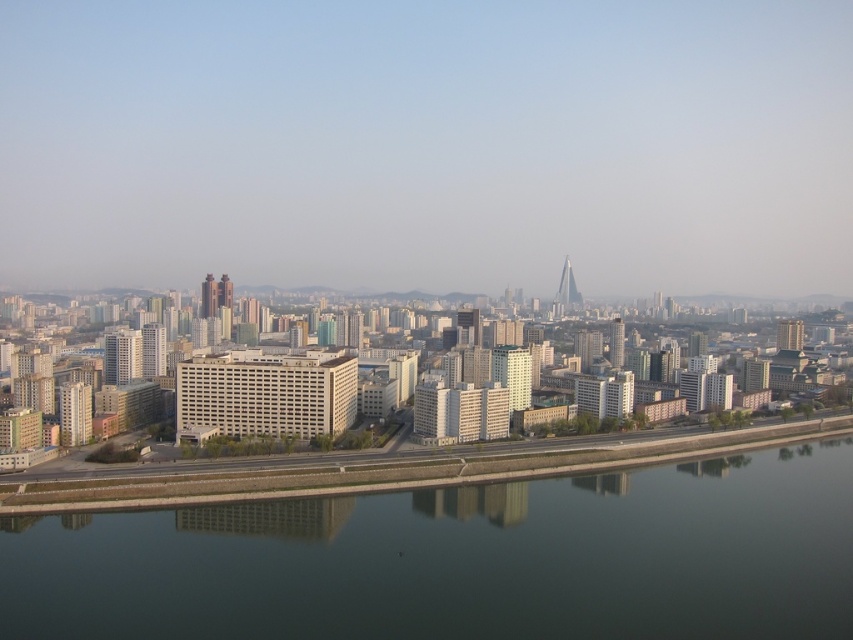
Does point (71, 435) lie behind point (612, 336)?

No, it is not.

Does matte gray building at lower left appear on the left side of white glass tower at center-right?

Yes, matte gray building at lower left is to the left of white glass tower at center-right.

Who is more forward, (83, 424) or (612, 352)?

Positioned in front is point (83, 424).

Locate an element on the screen. The height and width of the screenshot is (640, 853). matte gray building at lower left is located at coordinates (74, 413).

Can you confirm if green reflective water at center is bigger than matte gray skyscraper at center-left?

Correct, green reflective water at center is larger in size than matte gray skyscraper at center-left.

Between point (712, 541) and point (202, 282), which one is positioned behind?

Point (202, 282)

Locate an element on the screen. Image resolution: width=853 pixels, height=640 pixels. green reflective water at center is located at coordinates (461, 561).

Who is lower down, matte gray building at lower left or matte gray skyscraper at center-left?

matte gray building at lower left is lower down.

Can you confirm if matte gray building at lower left is positioned above matte gray skyscraper at center-left?

Actually, matte gray building at lower left is below matte gray skyscraper at center-left.

Which is behind, point (70, 394) or point (206, 305)?

Positioned behind is point (206, 305).

The width and height of the screenshot is (853, 640). I want to click on matte gray building at lower left, so click(x=74, y=413).